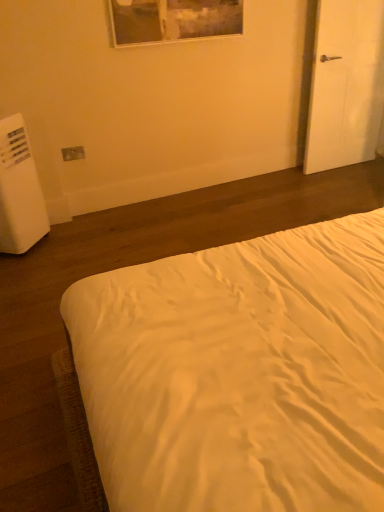
Question: Is white matte door at right situated inside matte plastic outlet at lower left or outside?

Choices:
 (A) outside
 (B) inside

Answer: (A)

Question: Would you say white matte door at right is to the left or to the right of matte plastic outlet at lower left in the picture?

Choices:
 (A) left
 (B) right

Answer: (B)

Question: Considering the real-world distances, which object is farthest from the white satin bed at center?

Choices:
 (A) white plastic water heater at left
 (B) matte plastic outlet at lower left
 (C) white matte door at right

Answer: (C)

Question: Which is nearer to the white matte door at right?

Choices:
 (A) white plastic water heater at left
 (B) matte plastic outlet at lower left
 (C) white satin bed at center

Answer: (B)